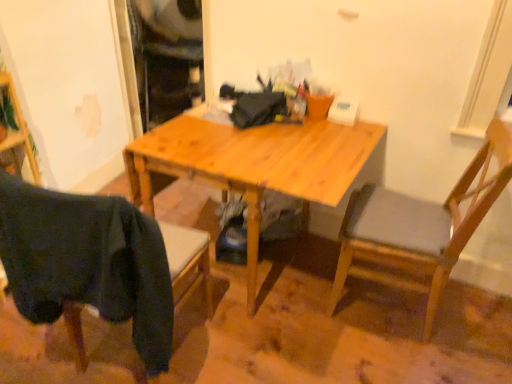
This screenshot has width=512, height=384. What do you see at coordinates (93, 264) in the screenshot?
I see `dark fabric chair at lower left, which ranks as the 2th chair in right-to-left order` at bounding box center [93, 264].

What do you see at coordinates (253, 165) in the screenshot? The width and height of the screenshot is (512, 384). I see `light wood desk at center` at bounding box center [253, 165].

Locate an element on the screen. This screenshot has height=384, width=512. dark fabric chair at lower left, which is the 1th chair in left-to-right order is located at coordinates (93, 264).

From a real-world perspective, which is physically above, light wood desk at center or wooden chair at right, the 2th chair in the left-to-right sequence?

wooden chair at right, the 2th chair in the left-to-right sequence, from a real-world perspective.

Is point (250, 283) less distant than point (379, 274)?

Yes, point (250, 283) is in front of point (379, 274).

Does light wood desk at center have a lesser height compared to wooden chair at right, the first chair in the right-to-left sequence?

Yes.

Is dark fabric chair at lower left, which is the 1th chair in left-to-right order, spatially inside wooden chair at right, the 2th chair in the left-to-right sequence, or outside of it?

dark fabric chair at lower left, which is the 1th chair in left-to-right order, is not inside wooden chair at right, the 2th chair in the left-to-right sequence, it's outside.

From the picture: Which is more to the right, dark fabric chair at lower left, which is the 1th chair in left-to-right order, or wooden chair at right, the first chair in the right-to-left sequence?

wooden chair at right, the first chair in the right-to-left sequence, is more to the right.

Who is shorter, dark fabric chair at lower left, which is the 1th chair in left-to-right order, or wooden chair at right, the 2th chair in the left-to-right sequence?

With less height is dark fabric chair at lower left, which is the 1th chair in left-to-right order.

Considering the sizes of objects light wood desk at center and dark fabric chair at lower left, which ranks as the 2th chair in right-to-left order, in the image provided, who is taller, light wood desk at center or dark fabric chair at lower left, which ranks as the 2th chair in right-to-left order,?

light wood desk at center.

Considering the sizes of objects light wood desk at center and dark fabric chair at lower left, which ranks as the 2th chair in right-to-left order, in the image provided, who is bigger, light wood desk at center or dark fabric chair at lower left, which ranks as the 2th chair in right-to-left order,?

With larger size is light wood desk at center.

Which is more to the right, light wood desk at center or dark fabric chair at lower left, which is the 1th chair in left-to-right order?

light wood desk at center is more to the right.

Could you tell me if light wood desk at center is turned towards dark fabric chair at lower left, which is the 1th chair in left-to-right order?

Yes, light wood desk at center faces towards dark fabric chair at lower left, which is the 1th chair in left-to-right order.

From the image's perspective, which one is positioned lower, wooden chair at right, the 2th chair in the left-to-right sequence, or light wood desk at center?

wooden chair at right, the 2th chair in the left-to-right sequence.

Considering the sizes of wooden chair at right, the first chair in the right-to-left sequence, and light wood desk at center in the image, is wooden chair at right, the first chair in the right-to-left sequence, bigger or smaller than light wood desk at center?

Clearly, wooden chair at right, the first chair in the right-to-left sequence, is smaller in size than light wood desk at center.

Which object is positioned more to the right, wooden chair at right, the 2th chair in the left-to-right sequence, or light wood desk at center?

wooden chair at right, the 2th chair in the left-to-right sequence.

Is wooden chair at right, the 2th chair in the left-to-right sequence, closer to the viewer compared to light wood desk at center?

Yes.

Which is in front, dark fabric chair at lower left, which is the 1th chair in left-to-right order, or light wood desk at center?

dark fabric chair at lower left, which is the 1th chair in left-to-right order, is closer to the camera.

From a real-world perspective, which object stands above the other?

In real-world perspective, dark fabric chair at lower left, which ranks as the 2th chair in right-to-left order, is above.

Which is nearer, (9, 224) or (320, 157)?

The point (9, 224) is closer to the camera.

Considering the sizes of dark fabric chair at lower left, which is the 1th chair in left-to-right order, and light wood desk at center in the image, is dark fabric chair at lower left, which is the 1th chair in left-to-right order, wider or thinner than light wood desk at center?

Considering their sizes, dark fabric chair at lower left, which is the 1th chair in left-to-right order, looks slimmer than light wood desk at center.

Which object is wider, wooden chair at right, the 2th chair in the left-to-right sequence, or dark fabric chair at lower left, which ranks as the 2th chair in right-to-left order?

Wider between the two is wooden chair at right, the 2th chair in the left-to-right sequence.

Is wooden chair at right, the 2th chair in the left-to-right sequence, in front of or behind dark fabric chair at lower left, which ranks as the 2th chair in right-to-left order, in the image?

In the image, wooden chair at right, the 2th chair in the left-to-right sequence, appears behind dark fabric chair at lower left, which ranks as the 2th chair in right-to-left order.

Based on the photo, is wooden chair at right, the first chair in the right-to-left sequence, far away from dark fabric chair at lower left, which is the 1th chair in left-to-right order?

wooden chair at right, the first chair in the right-to-left sequence, is actually quite close to dark fabric chair at lower left, which is the 1th chair in left-to-right order.

Consider the image. Based on their sizes in the image, would you say wooden chair at right, the first chair in the right-to-left sequence, is bigger or smaller than dark fabric chair at lower left, which ranks as the 2th chair in right-to-left order?

wooden chair at right, the first chair in the right-to-left sequence, is bigger than dark fabric chair at lower left, which ranks as the 2th chair in right-to-left order.

Identify the location of desk behind the wooden chair at right, the 2th chair in the left-to-right sequence. The height and width of the screenshot is (384, 512). (253, 165).

Where is `chair below the wooden chair at right, the first chair in the right-to-left sequence (from the image's perspective)`? chair below the wooden chair at right, the first chair in the right-to-left sequence (from the image's perspective) is located at coordinates (93, 264).

Which object lies nearer to the anchor point wooden chair at right, the first chair in the right-to-left sequence, light wood desk at center or dark fabric chair at lower left, which ranks as the 2th chair in right-to-left order?

light wood desk at center is positioned closer to the anchor wooden chair at right, the first chair in the right-to-left sequence.

Considering their positions, is dark fabric chair at lower left, which ranks as the 2th chair in right-to-left order, positioned further to wooden chair at right, the 2th chair in the left-to-right sequence, than light wood desk at center?

The object further to wooden chair at right, the 2th chair in the left-to-right sequence, is dark fabric chair at lower left, which ranks as the 2th chair in right-to-left order.

From the image, which object appears to be nearer to dark fabric chair at lower left, which is the 1th chair in left-to-right order, wooden chair at right, the first chair in the right-to-left sequence, or light wood desk at center?

The object closer to dark fabric chair at lower left, which is the 1th chair in left-to-right order, is light wood desk at center.

Which object lies nearer to the anchor point light wood desk at center, dark fabric chair at lower left, which ranks as the 2th chair in right-to-left order, or wooden chair at right, the first chair in the right-to-left sequence?

wooden chair at right, the first chair in the right-to-left sequence, is closer to light wood desk at center.

When comparing their distances from dark fabric chair at lower left, which ranks as the 2th chair in right-to-left order, does light wood desk at center or wooden chair at right, the 2th chair in the left-to-right sequence, seem further?

wooden chair at right, the 2th chair in the left-to-right sequence, is positioned further to the anchor dark fabric chair at lower left, which ranks as the 2th chair in right-to-left order.

Estimate the real-world distances between objects in this image. Which object is further from light wood desk at center, wooden chair at right, the 2th chair in the left-to-right sequence, or dark fabric chair at lower left, which ranks as the 2th chair in right-to-left order?

dark fabric chair at lower left, which ranks as the 2th chair in right-to-left order, is positioned further to the anchor light wood desk at center.

Where is `desk located between dark fabric chair at lower left, which ranks as the 2th chair in right-to-left order, and wooden chair at right, the first chair in the right-to-left sequence, in the left-right direction`? The width and height of the screenshot is (512, 384). desk located between dark fabric chair at lower left, which ranks as the 2th chair in right-to-left order, and wooden chair at right, the first chair in the right-to-left sequence, in the left-right direction is located at coordinates (253, 165).